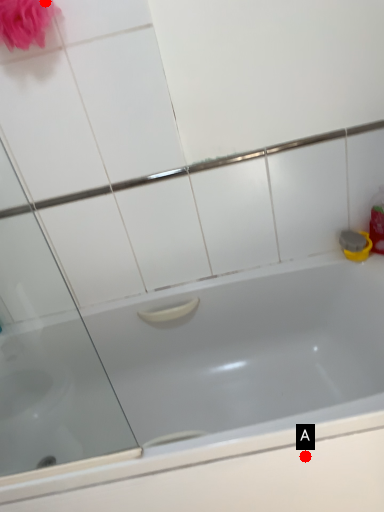
Question: Two points are circled on the image, labeled by A and B beside each circle. Among these points, which one is nearest to the camera?

Choices:
 (A) A is closer
 (B) B is closer

Answer: (A)